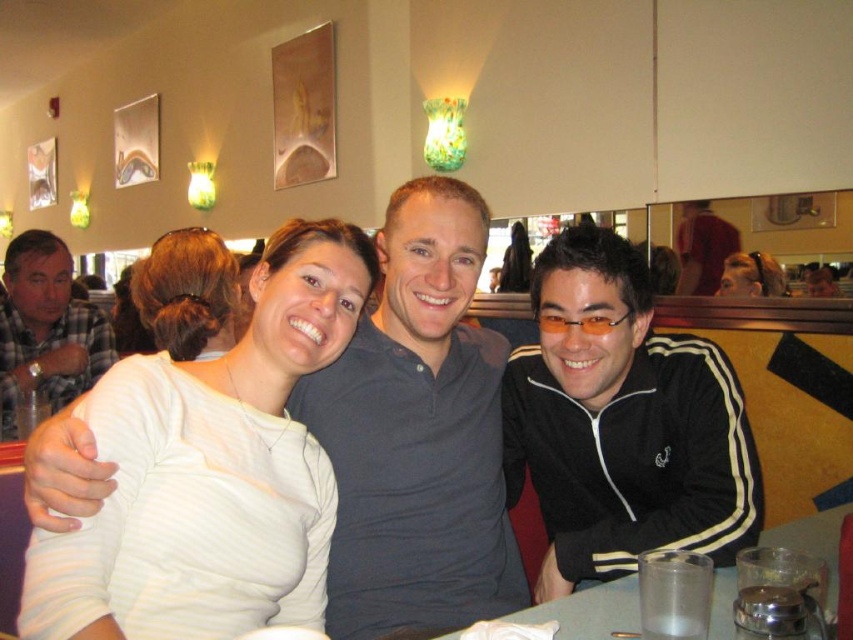
Can you confirm if dark blue cotton polo shirt at center is positioned above blonde hair at upper right?

Actually, dark blue cotton polo shirt at center is below blonde hair at upper right.

Who is more distant from viewer, (445, 444) or (769, 288)?

The point (769, 288) is more distant.

Find the location of a particular element. dark blue cotton polo shirt at center is located at coordinates (416, 433).

Is black zip-up jacket at center positioned behind clear plastic cup at lower center?

Yes, it is behind clear plastic cup at lower center.

Can you confirm if black zip-up jacket at center is smaller than clear plastic cup at lower center?

Actually, black zip-up jacket at center might be larger than clear plastic cup at lower center.

What do you see at coordinates (622, 422) in the screenshot?
I see `black zip-up jacket at center` at bounding box center [622, 422].

Identify the location of black zip-up jacket at center. This screenshot has width=853, height=640. pyautogui.click(x=622, y=422).

Between white matte shirt at center and plaid shirt at left, which one has more height?

plaid shirt at left

Between point (311, 298) and point (36, 248), which one is positioned in front?

Point (311, 298)

Who is more distant from viewer, (293, 369) or (16, 307)?

Point (16, 307)

Image resolution: width=853 pixels, height=640 pixels. Find the location of `white matte shirt at center`. white matte shirt at center is located at coordinates pos(227,458).